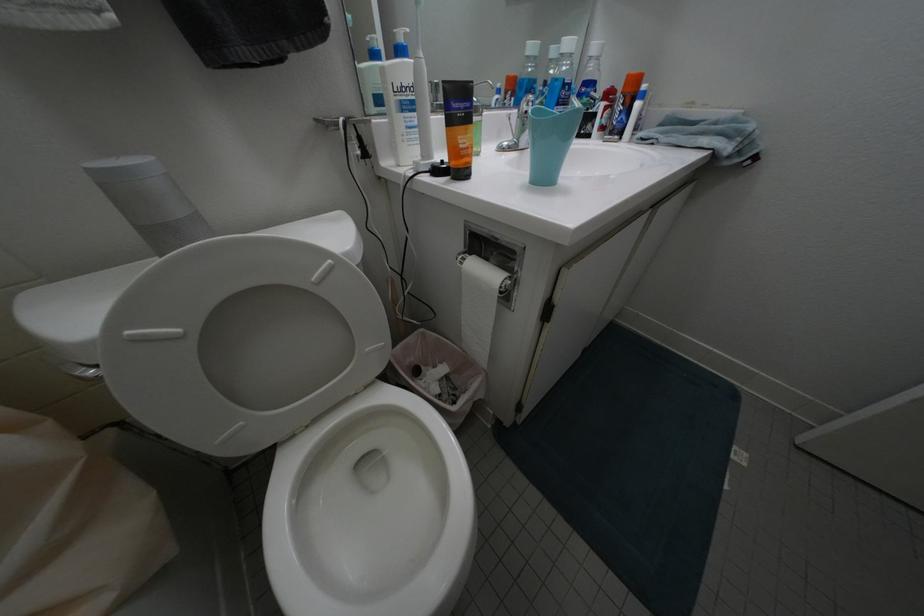
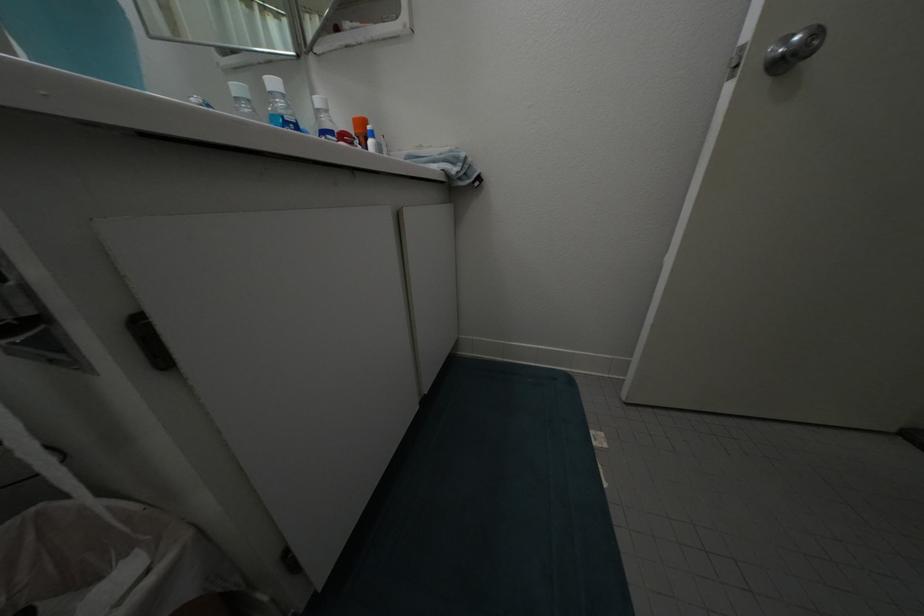
Question: The images are taken continuously from a first-person perspective. In which direction is your viewpoint rotating?

Choices:
 (A) Left
 (B) Right
 (C) Up
 (D) Down

Answer: (B)